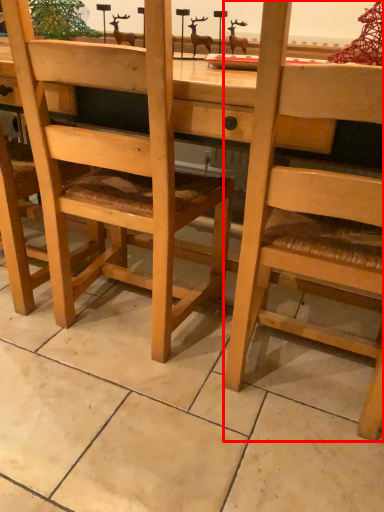
Question: From the image's perspective, where is chair (annotated by the red box) located in relation to chair in the image?

Choices:
 (A) below
 (B) above

Answer: (A)